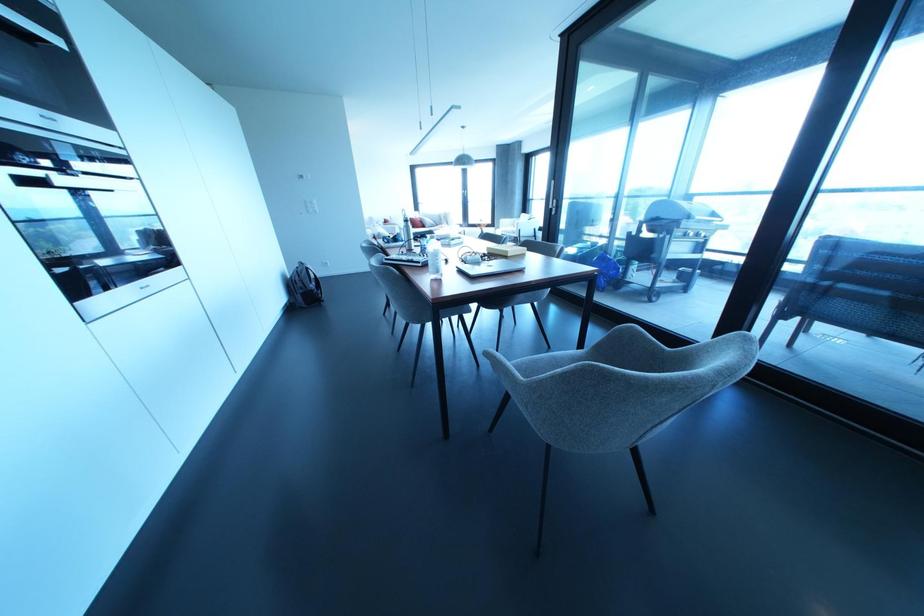
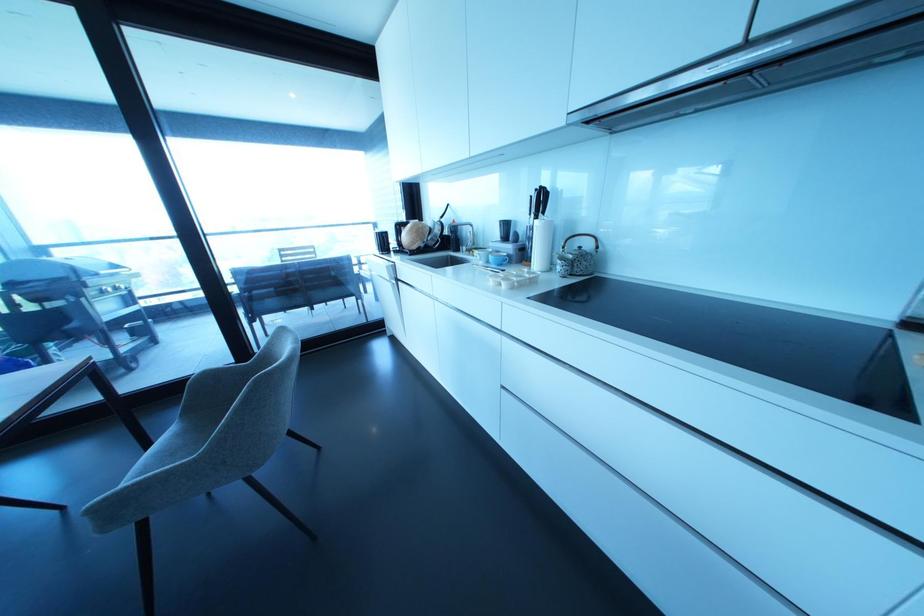
How did the camera likely rotate?

The camera rotated toward right-down.